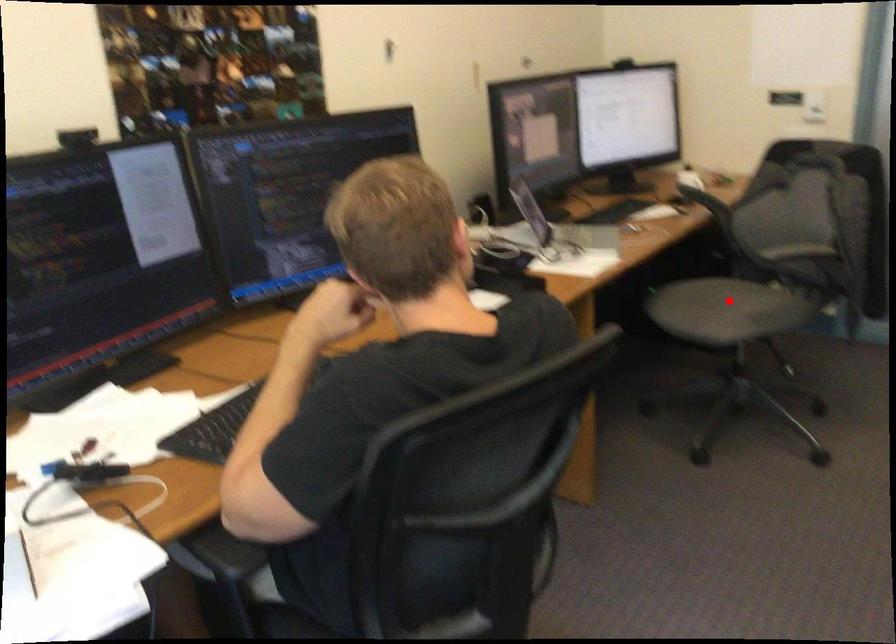
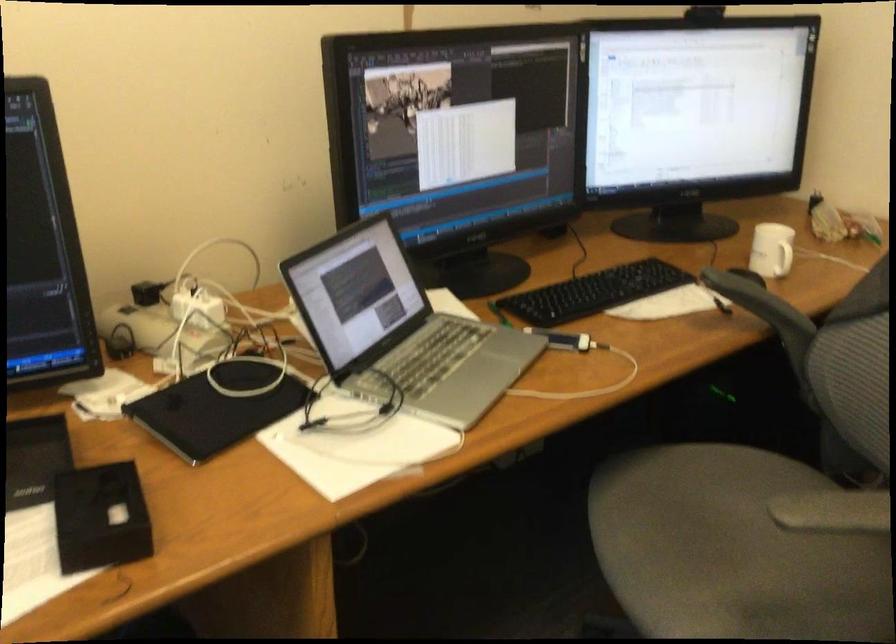
Question: I am providing you with two images of the same scene from different viewpoints. Image1 has a red point marked. In image2, the corresponding 3D location appears at what relative position? Reply with the corresponding letter.

Choices:
 (A) Closer
 (B) Farther

Answer: (A)